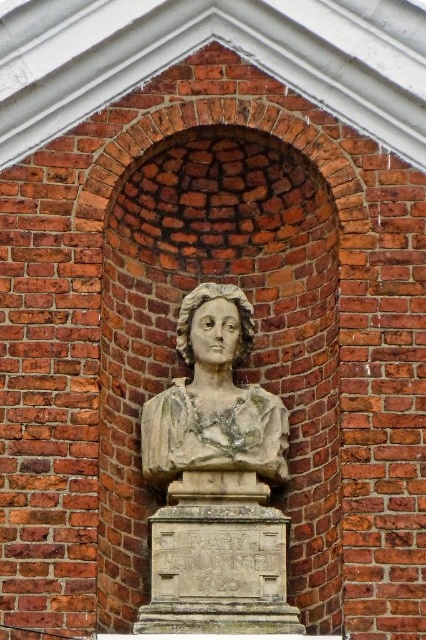
You are an art conservator examining the stone bust at center and the stone statue at center in the arched recess. Which object is closer to the viewer?

The stone bust at center is closer to the viewer than the stone statue at center because it is positioned in front of it.

You are an art conservator working in a gallery. You need to move the stone bust at center and the stone statue at center to a new exhibition space. The path between them is narrow. What is the minimum width required for the path to safely move both objects side by side?

The stone bust at center is 3.33 meters from the stone statue at center. Therefore, the minimum width required for the path should be at least 3.33 meters to safely move both objects side by side without collision.